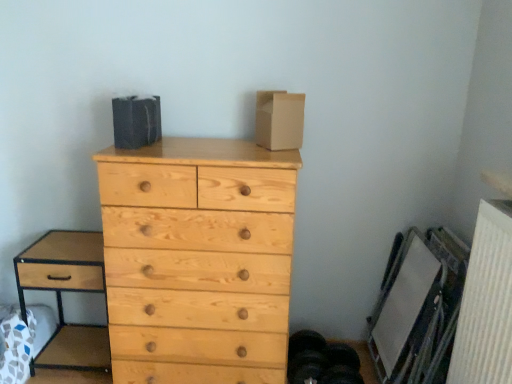
Question: Is brown wood nightstand at left positioned beyond the bounds of white textured radiator at lower right?

Choices:
 (A) no
 (B) yes

Answer: (B)

Question: Is brown wood nightstand at left thinner than white textured radiator at lower right?

Choices:
 (A) yes
 (B) no

Answer: (B)

Question: Can you confirm if brown wood nightstand at left is smaller than white textured radiator at lower right?

Choices:
 (A) yes
 (B) no

Answer: (B)

Question: From a real-world perspective, is brown wood nightstand at left over white textured radiator at lower right?

Choices:
 (A) yes
 (B) no

Answer: (B)

Question: Is the surface of brown wood nightstand at left in direct contact with white textured radiator at lower right?

Choices:
 (A) yes
 (B) no

Answer: (B)

Question: Does brown wood nightstand at left come in front of white textured radiator at lower right?

Choices:
 (A) no
 (B) yes

Answer: (A)

Question: Is brown wood nightstand at left further to the viewer compared to natural wood chest of drawers at center?

Choices:
 (A) yes
 (B) no

Answer: (A)

Question: From the image's perspective, would you say brown wood nightstand at left is shown under natural wood chest of drawers at center?

Choices:
 (A) no
 (B) yes

Answer: (B)

Question: Considering the relative sizes of brown wood nightstand at left and natural wood chest of drawers at center in the image provided, is brown wood nightstand at left taller than natural wood chest of drawers at center?

Choices:
 (A) no
 (B) yes

Answer: (A)

Question: Does brown wood nightstand at left have a lesser height compared to natural wood chest of drawers at center?

Choices:
 (A) yes
 (B) no

Answer: (A)

Question: Is brown wood nightstand at left touching natural wood chest of drawers at center?

Choices:
 (A) no
 (B) yes

Answer: (A)

Question: From a real-world perspective, is brown wood nightstand at left located beneath natural wood chest of drawers at center?

Choices:
 (A) yes
 (B) no

Answer: (A)

Question: Is natural wood chest of drawers at center located outside brown wood nightstand at left?

Choices:
 (A) yes
 (B) no

Answer: (A)